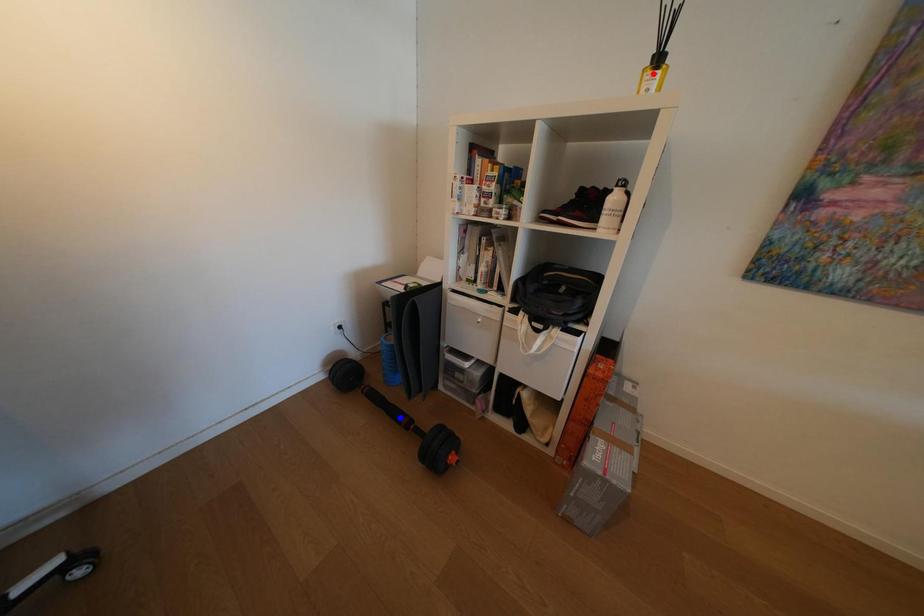
Question: In the image, two points are highlighted. Which point is nearer to the camera? Reply with the corresponding letter.

Choices:
 (A) blue point
 (B) red point

Answer: (B)